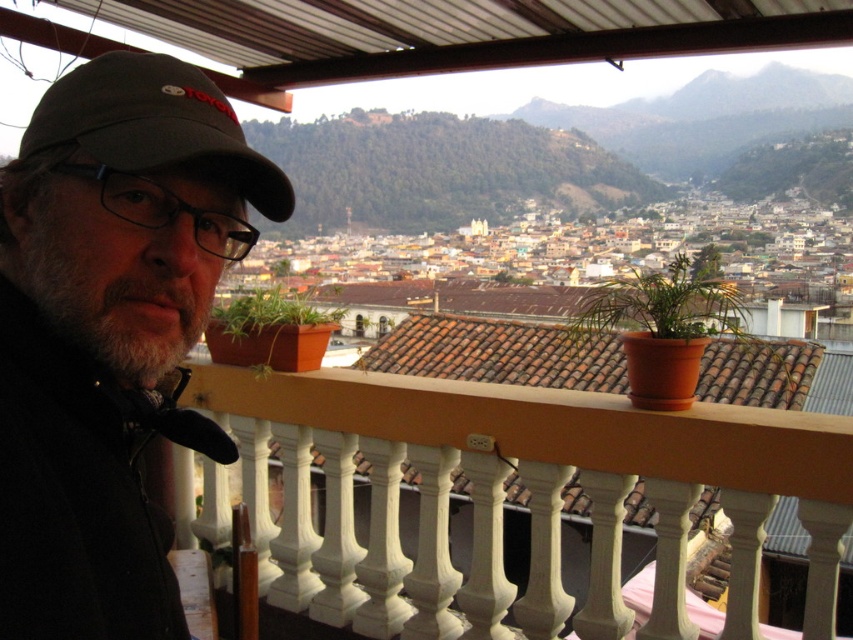
Is white painted wood balustrade at center above green matte plant at center?

No.

Describe the element at coordinates (529, 496) in the screenshot. This screenshot has height=640, width=853. I see `white painted wood balustrade at center` at that location.

I want to click on white painted wood balustrade at center, so click(529, 496).

Is terracotta clay pot at center positioned in front of green matte plant at center?

That is True.

Is point (648, 406) behind point (238, 301)?

No, (648, 406) is closer to viewer.

Image resolution: width=853 pixels, height=640 pixels. I want to click on terracotta clay pot at center, so click(663, 330).

Between black matte cap at upper left and dark gray fabric cap at upper left, which one is positioned lower?

Positioned lower is black matte cap at upper left.

Is black matte cap at upper left above dark gray fabric cap at upper left?

Actually, black matte cap at upper left is below dark gray fabric cap at upper left.

At what (x,y) coordinates should I click in order to perform the action: click on black matte cap at upper left. Please return your answer as a coordinate pair (x, y). Image resolution: width=853 pixels, height=640 pixels. Looking at the image, I should click on (107, 326).